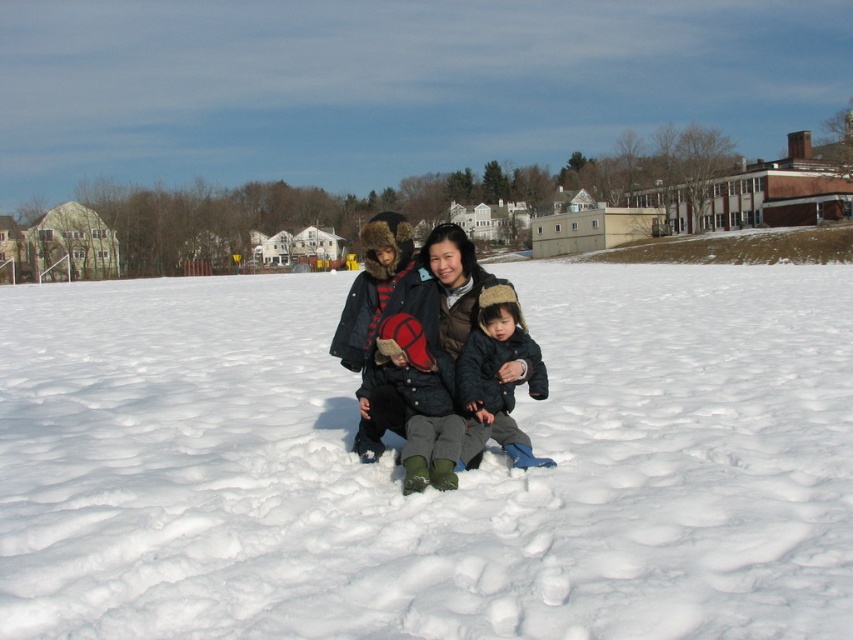
Is velvet red mittens at center above fluffy gray hat at center?

No, velvet red mittens at center is not above fluffy gray hat at center.

Looking at this image, who is higher up, velvet red mittens at center or fluffy gray hat at center?

Positioned higher is fluffy gray hat at center.

Measure the distance between point (447, 378) and camera.

Point (447, 378) and camera are 19.54 feet apart.

I want to click on velvet red mittens at center, so click(x=419, y=403).

Is point (844, 436) more distant than point (508, 371)?

Yes, it is.

Who is lower down, white fluffy snow at center or matte black jacket at center?

matte black jacket at center is below.

Between point (799, 355) and point (473, 314), which one is positioned in front?

Point (473, 314) is more forward.

The image size is (853, 640). In order to click on white fluffy snow at center in this screenshot , I will do `click(428, 488)`.

Between white fluffy snow at center and fluffy gray hat at center, which one appears on the right side from the viewer's perspective?

Positioned to the right is fluffy gray hat at center.

Can you confirm if white fluffy snow at center is positioned above fluffy gray hat at center?

Correct, white fluffy snow at center is located above fluffy gray hat at center.

Who is more distant from viewer, (120, 540) or (492, 419)?

The point (492, 419) is behind.

Locate an element on the screen. The height and width of the screenshot is (640, 853). white fluffy snow at center is located at coordinates (428, 488).